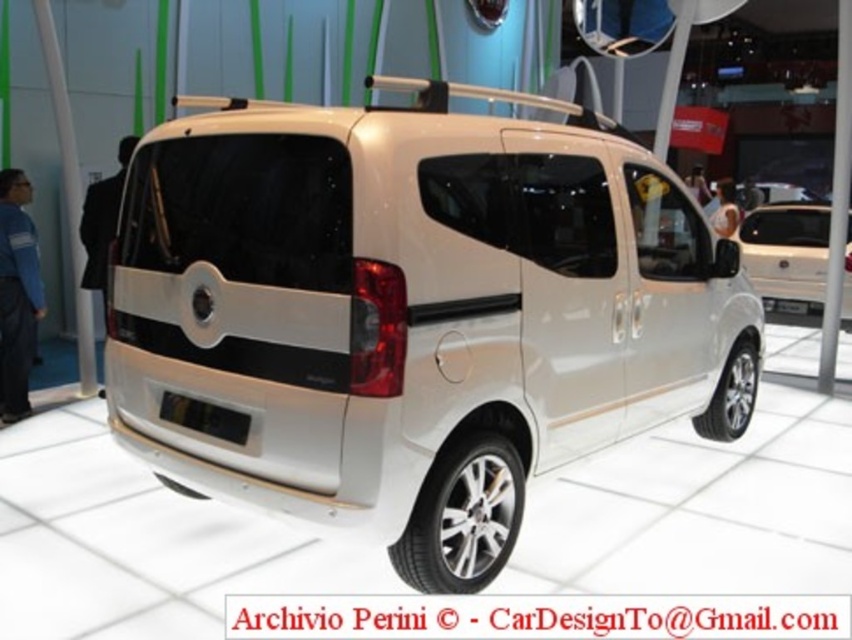
Question: Is white metallic minivan at center above white matte van at center?

Choices:
 (A) yes
 (B) no

Answer: (B)

Question: Which point is closer to the camera taking this photo?

Choices:
 (A) (265, 339)
 (B) (763, 280)

Answer: (A)

Question: Is white metallic minivan at center thinner than white matte van at center?

Choices:
 (A) no
 (B) yes

Answer: (A)

Question: Is white metallic minivan at center bigger than white matte van at center?

Choices:
 (A) no
 (B) yes

Answer: (B)

Question: Among these points, which one is nearest to the camera?

Choices:
 (A) (776, 312)
 (B) (446, 163)

Answer: (B)